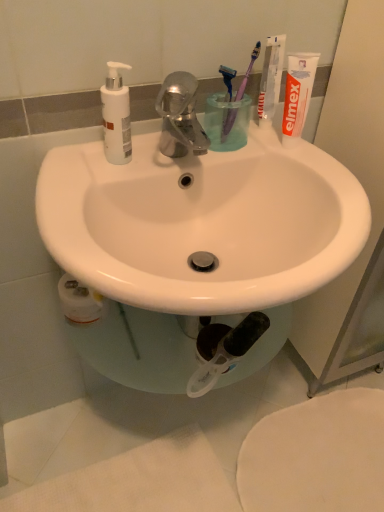
Locate an element on the screen. The height and width of the screenshot is (512, 384). free space in front of purple plastic toothbrush at upper right, the second toothbrush viewed from the left is located at coordinates (263, 155).